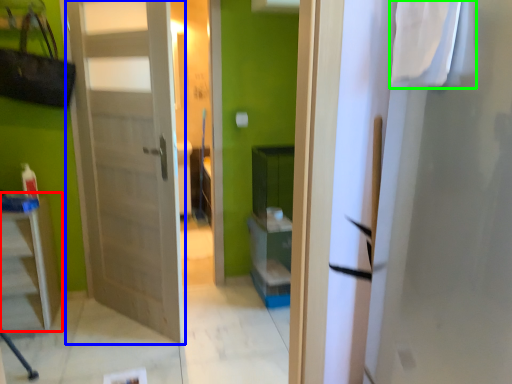
Question: Which object is the farthest from furniture (highlighted by a red box)? Choose among these: door (highlighted by a blue box) or laundry (highlighted by a green box).

Choices:
 (A) door
 (B) laundry

Answer: (B)